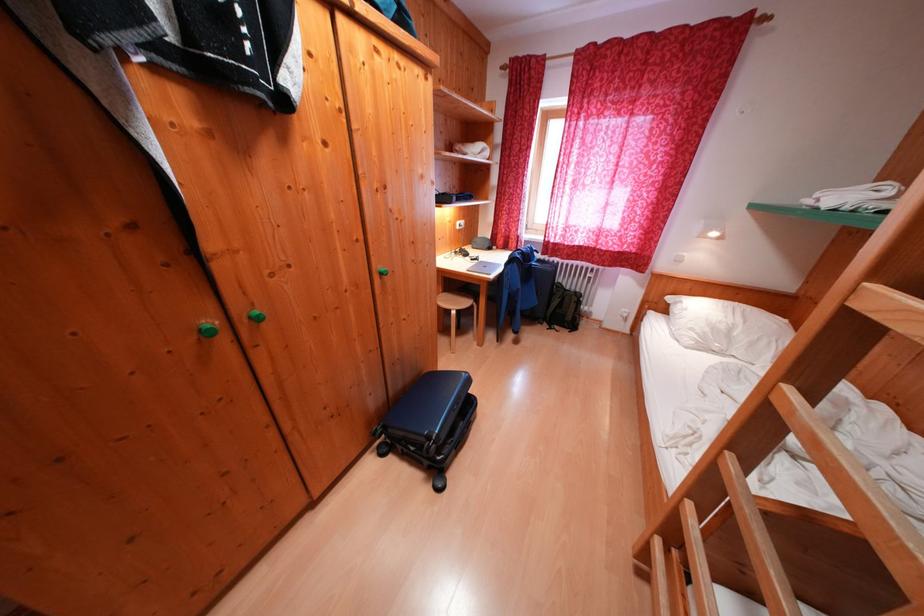
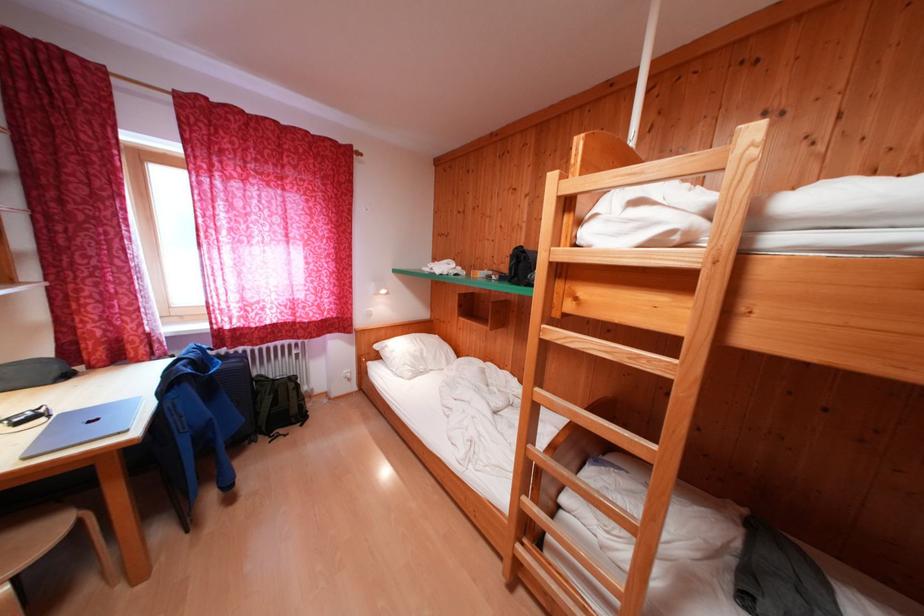
Locate, in the second image, the point that corresponds to point (673, 314) in the first image.

(385, 361)